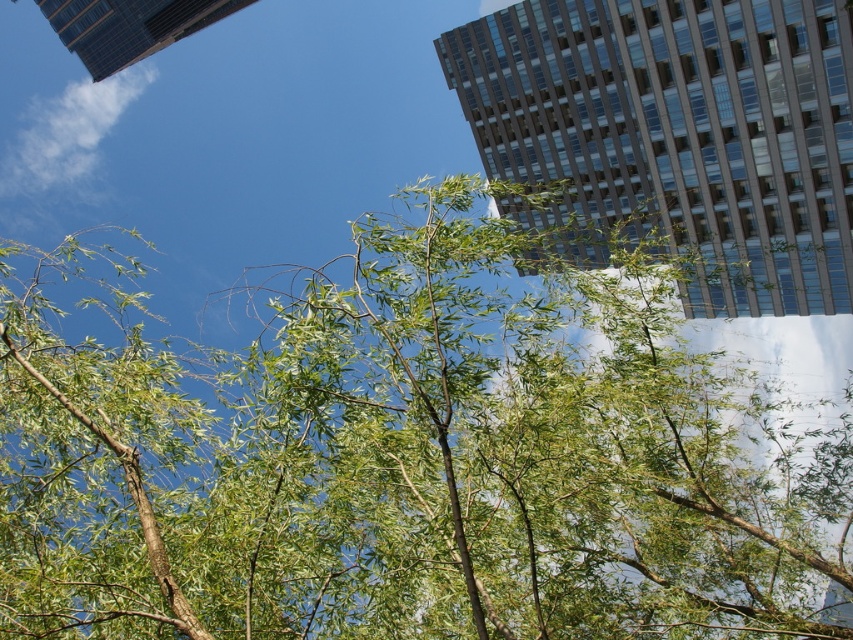
Can you confirm if glassy reflective building at upper right is thinner than glassy steel skyscraper at upper left?

Yes.

Is glassy reflective building at upper right below glassy steel skyscraper at upper left?

Correct, glassy reflective building at upper right is located below glassy steel skyscraper at upper left.

Between point (833, 300) and point (113, 26), which one is positioned in front?

Point (833, 300)

Find the location of a particular element. This screenshot has height=640, width=853. glassy reflective building at upper right is located at coordinates (682, 129).

Between green leafy branches at center and glassy reflective building at upper right, which one appears on the left side from the viewer's perspective?

green leafy branches at center is more to the left.

Consider the image. Can you confirm if green leafy branches at center is wider than glassy reflective building at upper right?

Incorrect, green leafy branches at center's width does not surpass glassy reflective building at upper right's.

The height and width of the screenshot is (640, 853). Find the location of `green leafy branches at center`. green leafy branches at center is located at coordinates (409, 464).

Consider the image. Is green leafy branches at center positioned behind glassy steel skyscraper at upper left?

No.

Is point (403, 625) closer to camera compared to point (223, 1)?

Yes, it is in front of point (223, 1).

Between point (584, 429) and point (96, 56), which one is positioned in front?

Point (584, 429) is more forward.

At what (x,y) coordinates should I click in order to perform the action: click on green leafy branches at center. Please return your answer as a coordinate pair (x, y). The image size is (853, 640). Looking at the image, I should click on (409, 464).